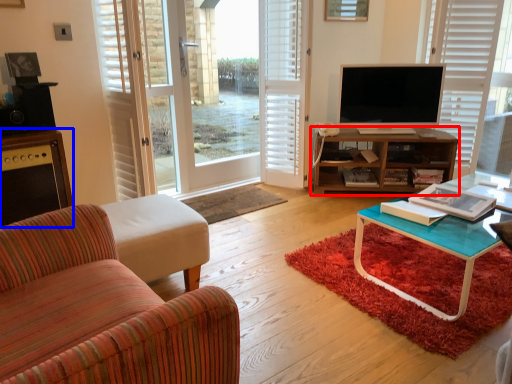
Question: Which object appears farthest to the camera in this image, shelf (highlighted by a red box) or cabinetry (highlighted by a blue box)?

Choices:
 (A) shelf
 (B) cabinetry

Answer: (A)